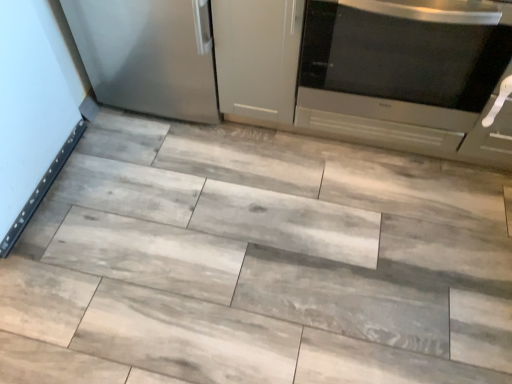
Question: Is gray wood tile at center beside satin metallic refrigerator at left?

Choices:
 (A) yes
 (B) no

Answer: (B)

Question: Does gray wood tile at center turn towards satin metallic refrigerator at left?

Choices:
 (A) no
 (B) yes

Answer: (A)

Question: Considering the relative sizes of gray wood tile at center and satin metallic refrigerator at left in the image provided, is gray wood tile at center shorter than satin metallic refrigerator at left?

Choices:
 (A) yes
 (B) no

Answer: (A)

Question: Does gray wood tile at center have a lesser width compared to satin metallic refrigerator at left?

Choices:
 (A) yes
 (B) no

Answer: (B)

Question: Considering the relative sizes of gray wood tile at center and satin metallic refrigerator at left in the image provided, is gray wood tile at center smaller than satin metallic refrigerator at left?

Choices:
 (A) yes
 (B) no

Answer: (A)

Question: Is satin metallic refrigerator at left situated inside gray wood tile at center or outside?

Choices:
 (A) inside
 (B) outside

Answer: (B)

Question: Is satin metallic refrigerator at left wider or thinner than gray wood tile at center?

Choices:
 (A) wide
 (B) thin

Answer: (B)

Question: Visually, is satin metallic refrigerator at left positioned to the left or to the right of gray wood tile at center?

Choices:
 (A) right
 (B) left

Answer: (B)

Question: From a real-world perspective, is satin metallic refrigerator at left positioned above or below gray wood tile at center?

Choices:
 (A) above
 (B) below

Answer: (A)

Question: From the image's perspective, is gray wood tile at center above or below satin silver microwave at right?

Choices:
 (A) below
 (B) above

Answer: (A)

Question: Is point (80, 279) closer or farther from the camera than point (399, 66)?

Choices:
 (A) farther
 (B) closer

Answer: (A)

Question: From a real-world perspective, is gray wood tile at center physically located above or below satin silver microwave at right?

Choices:
 (A) below
 (B) above

Answer: (A)

Question: Is gray wood tile at center wider or thinner than satin silver microwave at right?

Choices:
 (A) thin
 (B) wide

Answer: (B)

Question: Is point (138, 1) closer or farther from the camera than point (507, 49)?

Choices:
 (A) farther
 (B) closer

Answer: (A)

Question: Visually, is satin metallic refrigerator at left positioned to the left or to the right of satin silver microwave at right?

Choices:
 (A) right
 (B) left

Answer: (B)